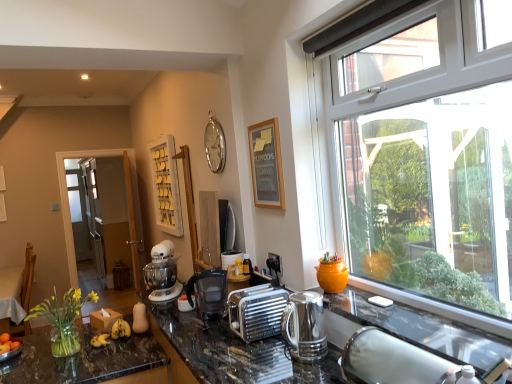
Find the location of a particular element. vacant region to the left of silver metallic toaster at center, the first appliance positioned from the front is located at coordinates (216, 337).